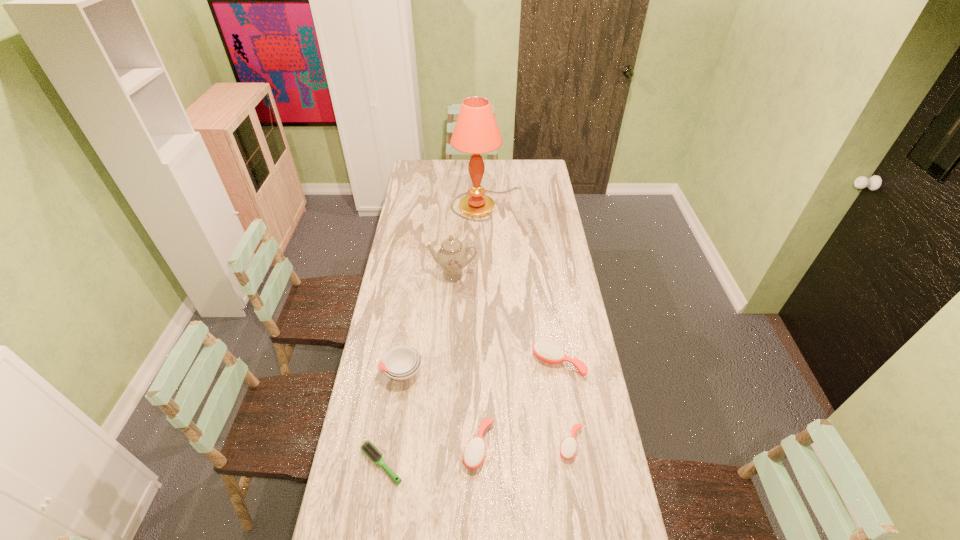
What are the coordinates of `hairbrush situated at the left edge` in the screenshot? It's located at (367, 448).

Locate an element on the screen. The width and height of the screenshot is (960, 540). free spot at the left edge of the desktop is located at coordinates (402, 430).

Where is `free region at the right edge of the desktop`? The width and height of the screenshot is (960, 540). free region at the right edge of the desktop is located at coordinates (553, 237).

At what (x,y) coordinates should I click in order to perform the action: click on empty space between the farthest hairbrush and the farthest object. Please return your answer as a coordinate pair (x, y). Looking at the image, I should click on (523, 283).

At what (x,y) coordinates should I click in order to perform the action: click on vacant point located between the second farthest object and the leftmost orange hairbrush. Please return your answer as a coordinate pair (x, y). This screenshot has height=540, width=960. Looking at the image, I should click on (466, 360).

At what (x,y) coordinates should I click in order to perform the action: click on free point between the leftmost hairbrush and the white soup bowl. Please return your answer as a coordinate pair (x, y). Looking at the image, I should click on (392, 417).

I want to click on vacant point located between the soup bowl and the shortest hairbrush, so click(x=392, y=417).

Locate an element on the screen. This screenshot has width=960, height=540. unoccupied position between the smallest orange hairbrush and the lamp is located at coordinates (529, 323).

What are the coordinates of `vacant space that is in between the smallest orange hairbrush and the third shortest hairbrush` in the screenshot? It's located at (525, 445).

This screenshot has height=540, width=960. Identify the location of free space between the smallest orange hairbrush and the soup bowl. (487, 408).